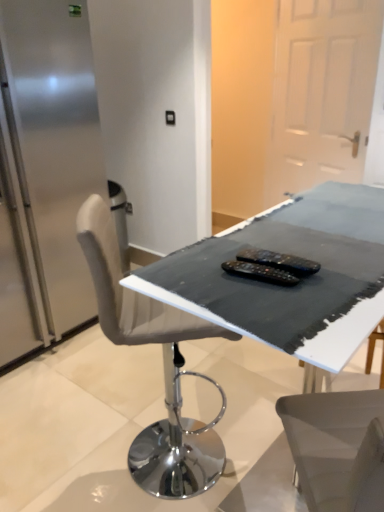
Question: Is black plastic remote controls at center, arranged as the 2th equipment when viewed from the top, at the right side of white matte door at upper right?

Choices:
 (A) no
 (B) yes

Answer: (A)

Question: Is black plastic remote controls at center, acting as the 1th equipment starting from the bottom, facing towards white matte door at upper right?

Choices:
 (A) yes
 (B) no

Answer: (A)

Question: From the image's perspective, would you say black plastic remote controls at center, arranged as the 2th equipment when viewed from the top, is shown under white matte door at upper right?

Choices:
 (A) yes
 (B) no

Answer: (A)

Question: Can you confirm if black plastic remote controls at center, arranged as the 2th equipment when viewed from the top, is thinner than white matte door at upper right?

Choices:
 (A) yes
 (B) no

Answer: (A)

Question: Is black plastic remote controls at center, arranged as the 2th equipment when viewed from the top, turned away from white matte door at upper right?

Choices:
 (A) no
 (B) yes

Answer: (A)

Question: In terms of height, does black fabric-covered table at center look taller or shorter compared to black plastic remote controls at center, the second equipment ordered from the bottom?

Choices:
 (A) tall
 (B) short

Answer: (A)

Question: Would you say black fabric-covered table at center is to the left or to the right of black plastic remote controls at center, the second equipment ordered from the bottom, in the picture?

Choices:
 (A) right
 (B) left

Answer: (A)

Question: Choose the correct answer: Is black fabric-covered table at center inside black plastic remote controls at center, the 1th equipment viewed from the top, or outside it?

Choices:
 (A) inside
 (B) outside

Answer: (B)

Question: From a real-world perspective, relative to black plastic remote controls at center, the 1th equipment viewed from the top, is black fabric-covered table at center vertically above or below?

Choices:
 (A) below
 (B) above

Answer: (A)

Question: Does point (294, 55) appear closer or farther from the camera than point (309, 266)?

Choices:
 (A) farther
 (B) closer

Answer: (A)

Question: Considering the positions of white matte door at upper right and black plastic remote controls at center, the second equipment ordered from the bottom, in the image, is white matte door at upper right taller or shorter than black plastic remote controls at center, the second equipment ordered from the bottom,?

Choices:
 (A) tall
 (B) short

Answer: (A)

Question: Is white matte door at upper right situated inside black plastic remote controls at center, the second equipment ordered from the bottom, or outside?

Choices:
 (A) inside
 (B) outside

Answer: (B)

Question: In terms of size, does white matte door at upper right appear bigger or smaller than black plastic remote controls at center, the second equipment ordered from the bottom?

Choices:
 (A) big
 (B) small

Answer: (A)

Question: Based on their sizes in the image, would you say black plastic remote controls at center, arranged as the 2th equipment when viewed from the top, is bigger or smaller than black fabric-covered table at center?

Choices:
 (A) small
 (B) big

Answer: (A)

Question: From the image's perspective, is black plastic remote controls at center, acting as the 1th equipment starting from the bottom, located above or below black fabric-covered table at center?

Choices:
 (A) below
 (B) above

Answer: (A)